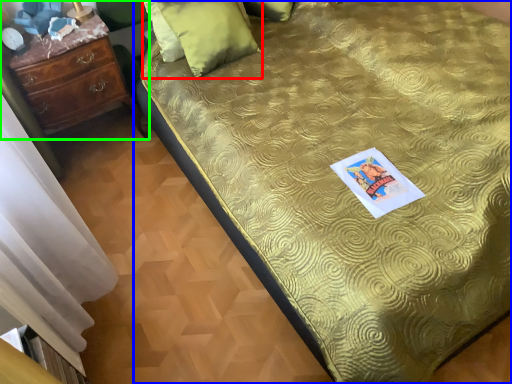
Question: Based on their relative distances, which object is farther from pillow (highlighted by a red box)? Choose from bed (highlighted by a blue box) and chest of drawers (highlighted by a green box).

Choices:
 (A) bed
 (B) chest of drawers

Answer: (A)